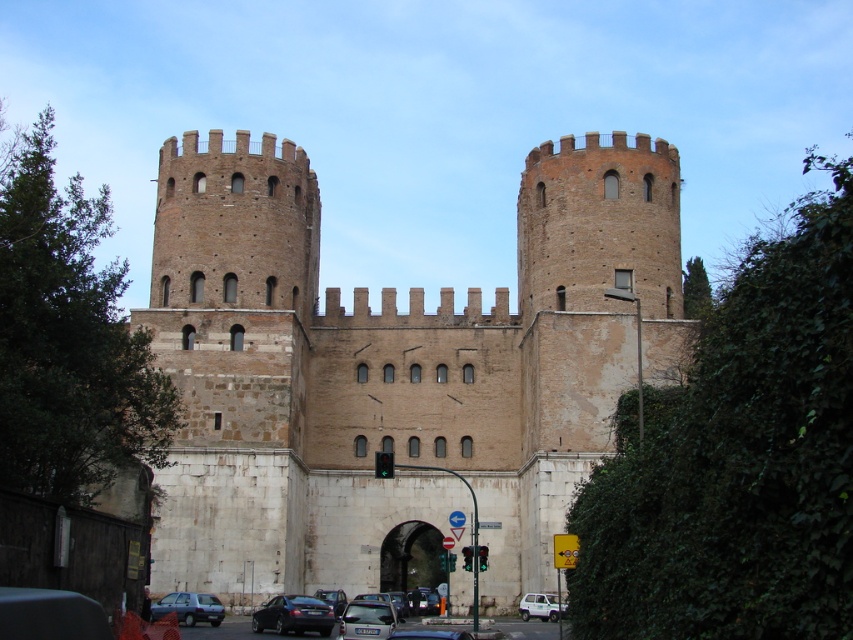
Question: Which object is the closest to the brown stone castle at center?

Choices:
 (A) matte gray car at lower left
 (B) shiny black sedan at lower center
 (C) metallic silver car at center
 (D) white plastic van at lower center

Answer: (A)

Question: Among these objects, which one is nearest to the camera?

Choices:
 (A) brown stone castle at center
 (B) shiny black sedan at lower center
 (C) metallic silver car at center

Answer: (C)

Question: Is shiny black sedan at lower center positioned at the back of metallic silver car at center?

Choices:
 (A) no
 (B) yes

Answer: (B)

Question: Which object appears farthest from the camera in this image?

Choices:
 (A) white plastic van at lower center
 (B) metallic silver car at center
 (C) shiny black sedan at lower center

Answer: (A)

Question: Is metallic silver car at center wider than matte gray car at lower left?

Choices:
 (A) no
 (B) yes

Answer: (A)

Question: Is metallic silver car at center below matte gray car at lower left?

Choices:
 (A) no
 (B) yes

Answer: (B)